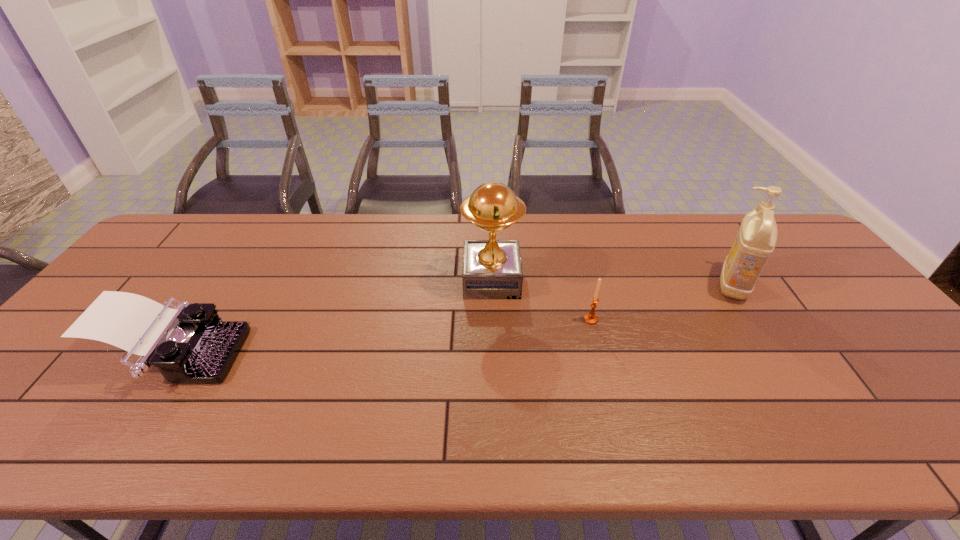
Locate an element on the screen. The image size is (960, 540). vacant area in the image that satisfies the following two spatial constraints: 1. on the front-facing side of the second object from left to right; 2. on the back side of the detergent is located at coordinates pyautogui.click(x=492, y=285).

This screenshot has width=960, height=540. I want to click on vacant space that satisfies the following two spatial constraints: 1. on the front-facing side of the second object from left to right; 2. on the left side of the second object from right to left, so click(x=492, y=320).

Where is `free spot that satisfies the following two spatial constraints: 1. on the front-facing side of the detergent; 2. on the right side of the third object from right to left`? The height and width of the screenshot is (540, 960). free spot that satisfies the following two spatial constraints: 1. on the front-facing side of the detergent; 2. on the right side of the third object from right to left is located at coordinates (492, 285).

The height and width of the screenshot is (540, 960). What are the coordinates of `free space that satisfies the following two spatial constraints: 1. on the front-facing side of the third object from right to left; 2. on the right side of the detergent` in the screenshot? It's located at (492, 285).